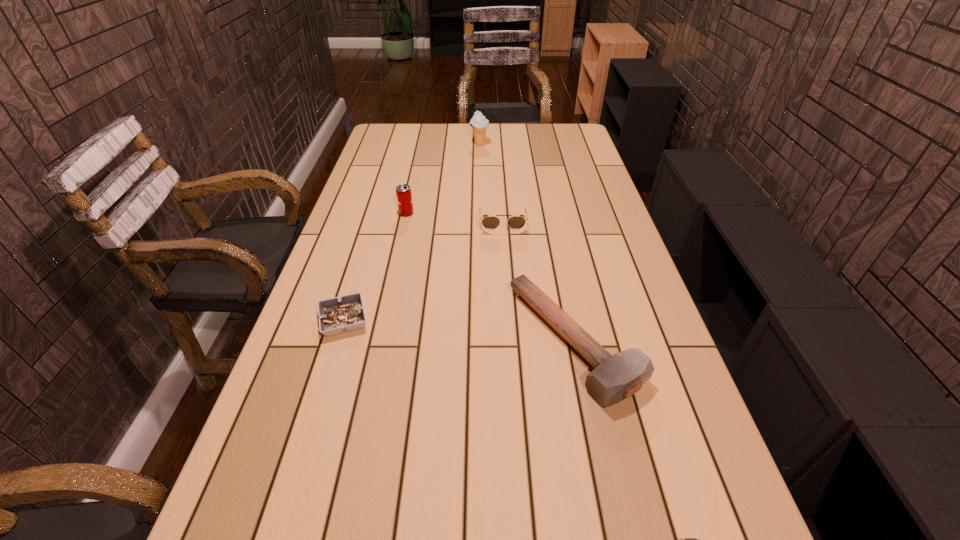
Identify the location of icecream. This screenshot has width=960, height=540. (479, 123).

Locate an element on the screen. This screenshot has height=540, width=960. the tallest object is located at coordinates (479, 123).

At what (x,y) coordinates should I click in order to perform the action: click on the second tallest object. Please return your answer as a coordinate pair (x, y). The width and height of the screenshot is (960, 540). Looking at the image, I should click on (403, 191).

The image size is (960, 540). Find the location of `beer can`. beer can is located at coordinates (403, 191).

Where is `sunglasses`? The height and width of the screenshot is (540, 960). sunglasses is located at coordinates (490, 222).

Identify the location of mallet. (615, 377).

The width and height of the screenshot is (960, 540). I want to click on the farther ashtray, so click(x=345, y=314).

The image size is (960, 540). Find the location of `the leftmost object`. the leftmost object is located at coordinates (345, 314).

You are a GUI agent. You are given a task and a screenshot of the screen. Output one action in this format:
    pyautogui.click(x=<x>, y=<y>)
    Task: Click on the blank area located 0.260m on the left of the farthest object
    
    Given the screenshot: What is the action you would take?
    pyautogui.click(x=409, y=145)

Locate an element on the screen. This screenshot has height=540, width=960. blank space located 0.300m on the front of the beer can is located at coordinates click(x=393, y=277).